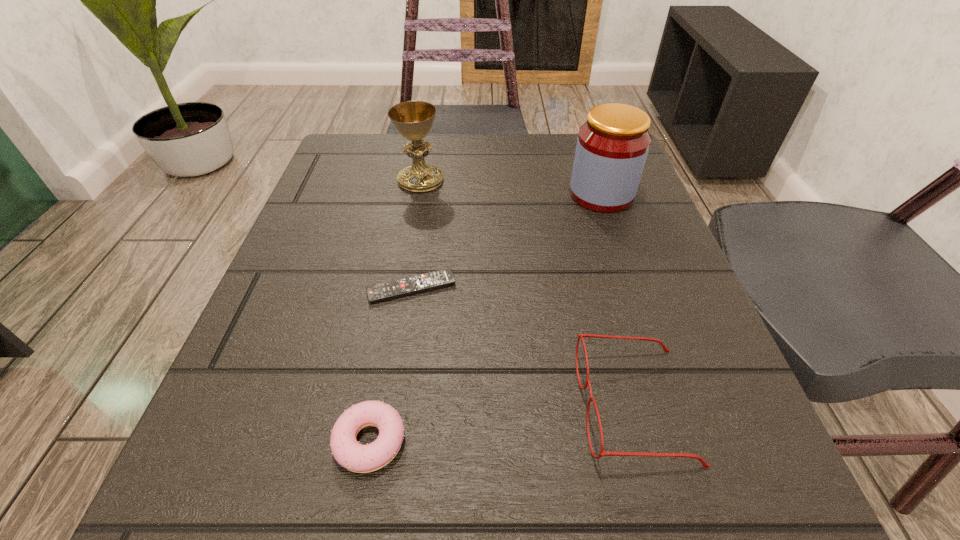
This screenshot has height=540, width=960. I want to click on jar, so click(612, 146).

Find the location of `chalice`. chalice is located at coordinates (413, 120).

Locate an element on the screen. spectacles is located at coordinates (705, 465).

I want to click on doughnut, so click(x=346, y=450).

The width and height of the screenshot is (960, 540). Find the location of `the shortest object`. the shortest object is located at coordinates (411, 285).

Identify the location of the third farthest object. The height and width of the screenshot is (540, 960). (411, 285).

This screenshot has width=960, height=540. Identify the location of free point located on the left of the jar. (406, 194).

This screenshot has height=540, width=960. Find the location of `vacant space positioned on the front of the chalice`. vacant space positioned on the front of the chalice is located at coordinates (400, 299).

The width and height of the screenshot is (960, 540). I want to click on free space located on the face of the spectacles, so click(x=541, y=406).

Locate an element on the screen. free space located 0.350m on the face of the spectacles is located at coordinates (299, 406).